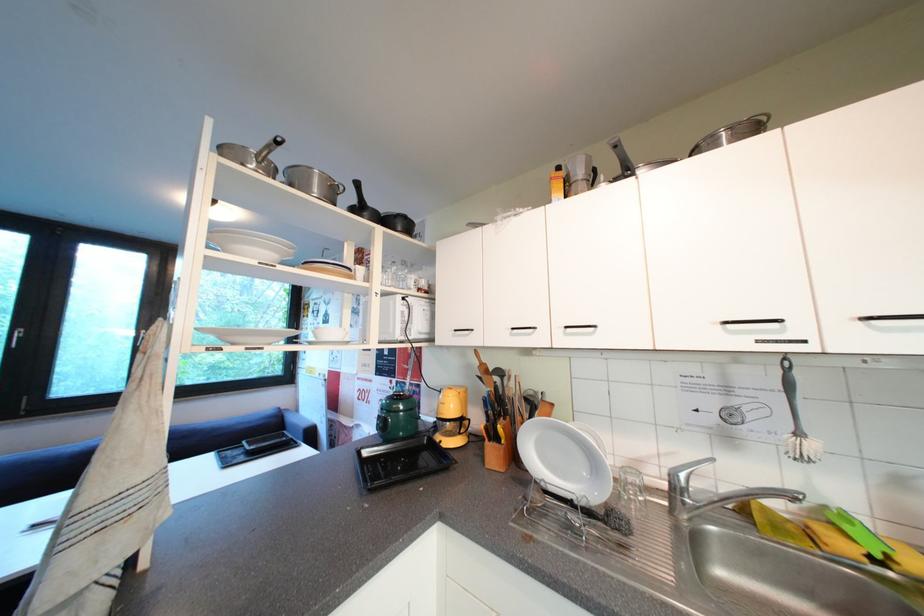
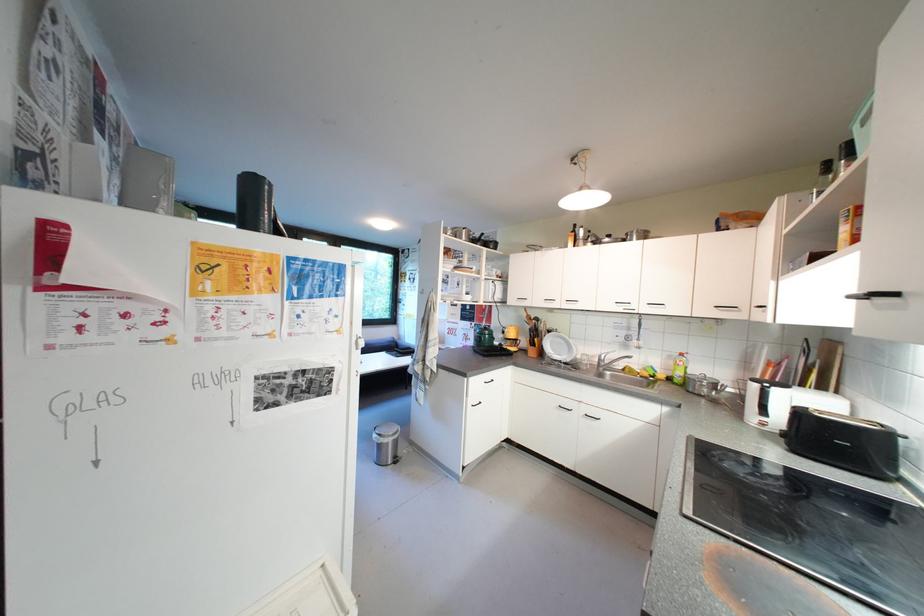
The point at (648,464) is marked in the first image. Where is the corresponding point in the second image?

(602, 359)